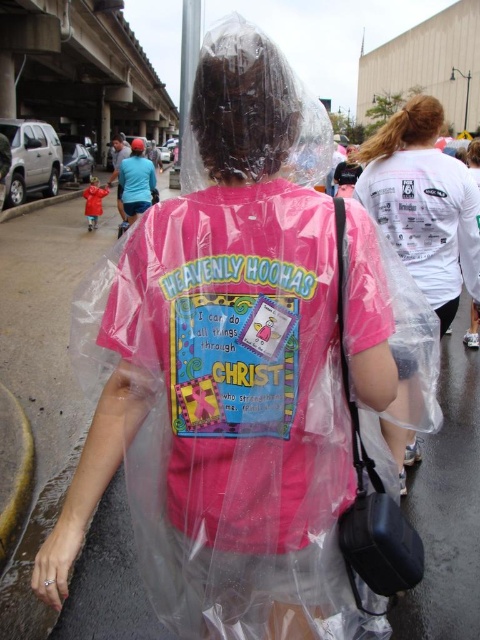
You are a delivery person who needs to hand over a package to someone. You see a transparent plastic bag at right and a black synthetic bag at right. Which bag is closer to the right side of the image?

The transparent plastic bag at right is closer to the right side of the image because it is positioned to the right of the black synthetic bag at right.

You are a delivery person who needs to place a package in the image. The package is 0.3 meters wide. Where should you place it so that it doesn,t overlap with the transparent plastic bag at right?

Place the package at a location away from the transparent plastic bag at right, such as the lower left area of the image since the bag is located at point (423, 204).

You are a delivery person who needs to choose a bag to carry a large package. You see a transparent plastic bag at right and a black synthetic bag at right. Which bag should you choose?

The transparent plastic bag at right is bigger than the black synthetic bag at right, so you should choose the transparent plastic bag at right to carry the large package.